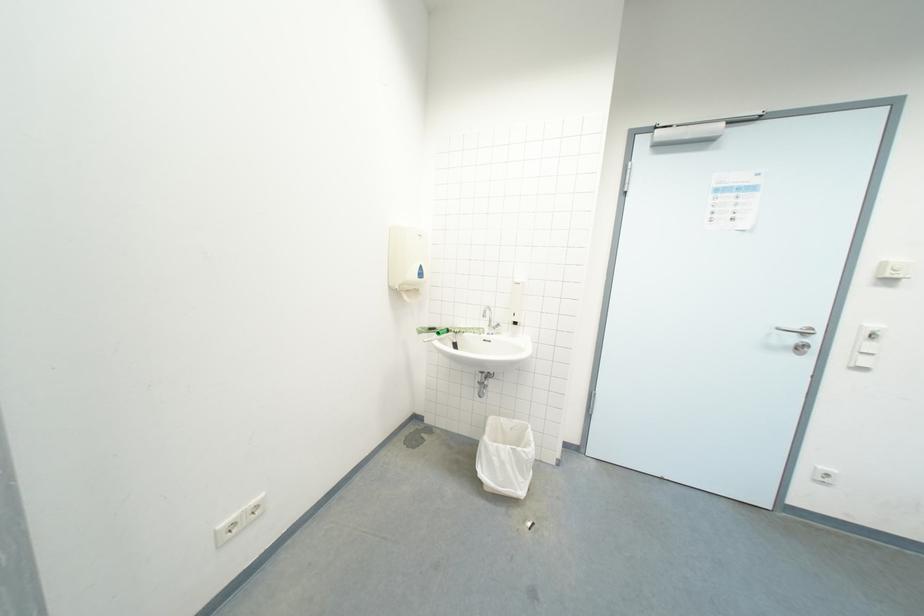
Identify the location of soap dispenser pump. coord(517,301).